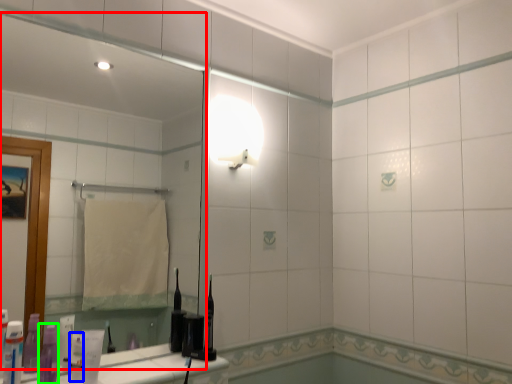
Question: Which object is the closest to the mirror (highlighted by a red box)? Choose among these: toiletry (highlighted by a blue box) or toiletry (highlighted by a green box).

Choices:
 (A) toiletry
 (B) toiletry

Answer: (B)